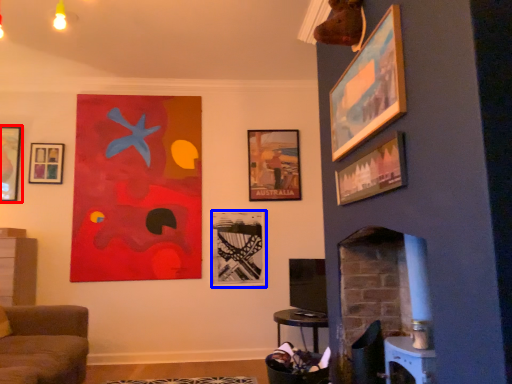
Question: Which object is closer to the camera taking this photo, picture frame (highlighted by a red box) or picture frame (highlighted by a blue box)?

Choices:
 (A) picture frame
 (B) picture frame

Answer: (A)